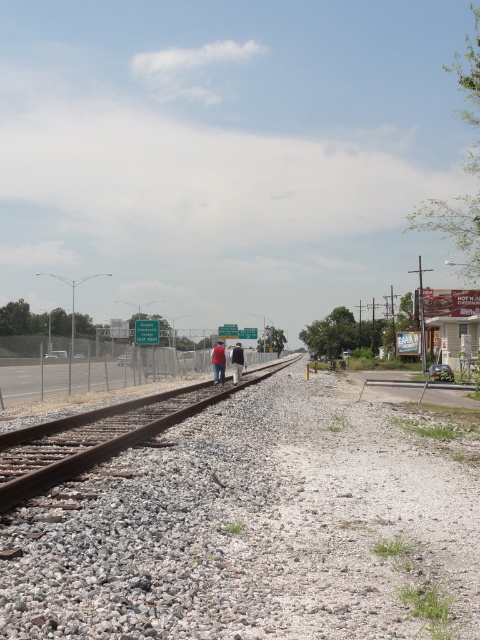
Find the location of a particular element. The height and width of the screenshot is (640, 480). red matte jacket at center is located at coordinates (218, 362).

Is red matte jacket at center positioned at the back of dark blue jacket at center?

That is True.

Image resolution: width=480 pixels, height=640 pixels. What do you see at coordinates (218, 362) in the screenshot?
I see `red matte jacket at center` at bounding box center [218, 362].

The width and height of the screenshot is (480, 640). Find the location of `red matte jacket at center`. red matte jacket at center is located at coordinates (218, 362).

Is the position of brown metal train track at center more distant than that of reddish-brown leather jacket at center?

That is False.

Who is more forward, (49, 484) or (232, 349)?

Point (49, 484)

Locate an element on the screen. brown metal train track at center is located at coordinates (99, 442).

Find the location of a particular element. reddish-brown leather jacket at center is located at coordinates (218, 362).

Is point (216, 369) closer to camera compared to point (240, 368)?

Yes, point (216, 369) is closer to viewer.

Identify the location of reddish-brown leather jacket at center. The height and width of the screenshot is (640, 480). (218, 362).